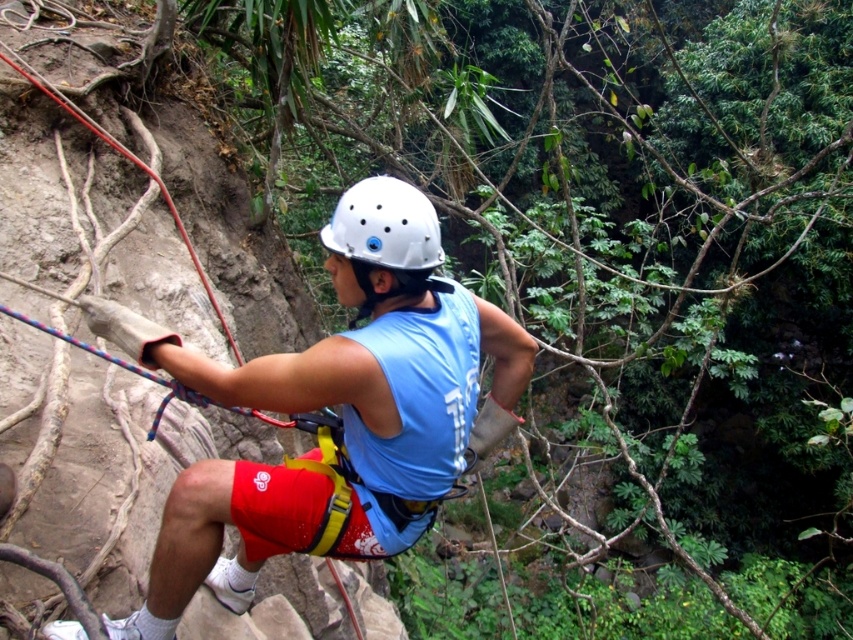
Can you confirm if matte blue tank top at center is positioned to the left of white matte helmet at center?

Indeed, matte blue tank top at center is positioned on the left side of white matte helmet at center.

Can you confirm if matte blue tank top at center is positioned to the right of white matte helmet at center?

Incorrect, matte blue tank top at center is not on the right side of white matte helmet at center.

The height and width of the screenshot is (640, 853). What are the coordinates of `matte blue tank top at center` in the screenshot? It's located at (341, 412).